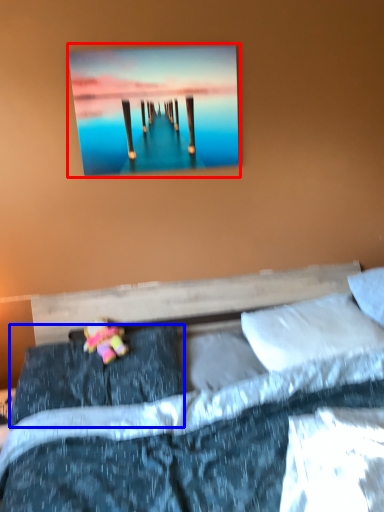
Question: Which of the following is the farthest to the observer, picture frame (highlighted by a red box) or pillow (highlighted by a blue box)?

Choices:
 (A) picture frame
 (B) pillow

Answer: (A)